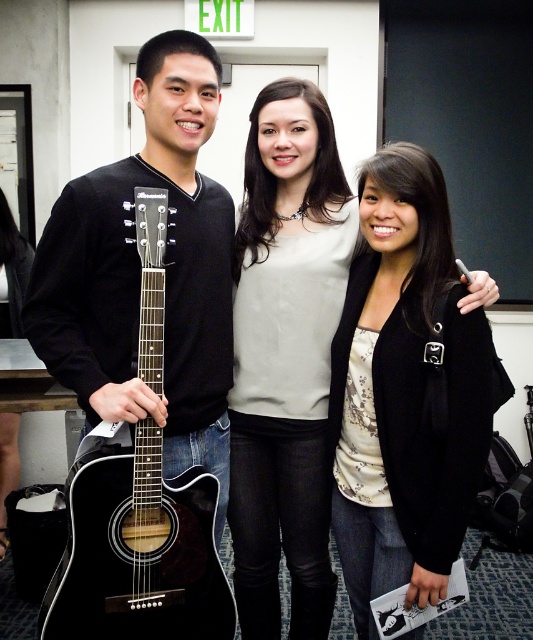
Question: Does black matte jacket at center have a greater width compared to black acoustic guitar at left?

Choices:
 (A) yes
 (B) no

Answer: (B)

Question: Can you confirm if matte white blouse at center is positioned above black acoustic guitar at left?

Choices:
 (A) yes
 (B) no

Answer: (A)

Question: Which object is the closest to the black acoustic guitar at left?

Choices:
 (A) black matte jacket at center
 (B) matte white blouse at center

Answer: (B)

Question: Which object is positioned closest to the black acoustic guitar at left?

Choices:
 (A) matte white blouse at center
 (B) black matte jacket at center

Answer: (A)

Question: Which is nearer to the black matte jacket at center?

Choices:
 (A) matte white blouse at center
 (B) black acoustic guitar at left

Answer: (A)

Question: Does matte white blouse at center have a larger size compared to black acoustic guitar at left?

Choices:
 (A) yes
 (B) no

Answer: (A)